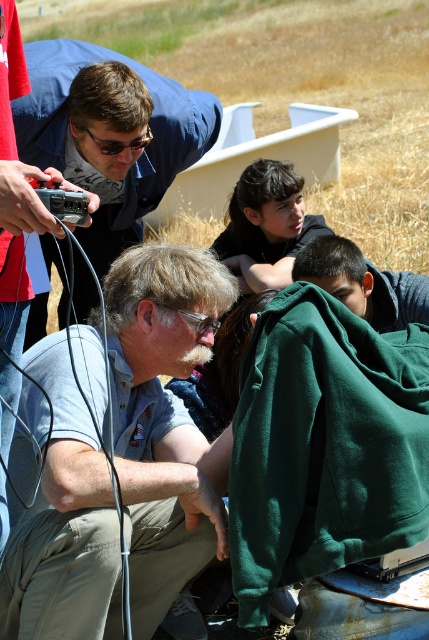
Is point (317, 243) behind point (78, 198)?

Yes, point (317, 243) is behind point (78, 198).

Measure the distance from dark green hoodie at lower right to matte black camera at left.

The distance of dark green hoodie at lower right from matte black camera at left is 1.61 meters.

Who is more distant from viewer, (380, 310) or (81, 189)?

The point (380, 310) is behind.

This screenshot has width=429, height=640. What are the coordinates of `dark green hoodie at lower right` in the screenshot? It's located at (362, 284).

Can you confirm if green fleece blanket at lower right is taller than dark green hoodie at lower right?

Correct, green fleece blanket at lower right is much taller as dark green hoodie at lower right.

Find the location of a particular element. green fleece blanket at lower right is located at coordinates (323, 445).

Locate an element on the screen. green fleece blanket at lower right is located at coordinates (323, 445).

Is dark brown hair at center to the left of dark green hoodie at lower right from the viewer's perspective?

Yes, dark brown hair at center is to the left of dark green hoodie at lower right.

Who is lower down, dark brown hair at center or dark green hoodie at lower right?

dark green hoodie at lower right is lower down.

Find the location of a particular element. Image resolution: width=429 pixels, height=640 pixels. dark brown hair at center is located at coordinates (265, 227).